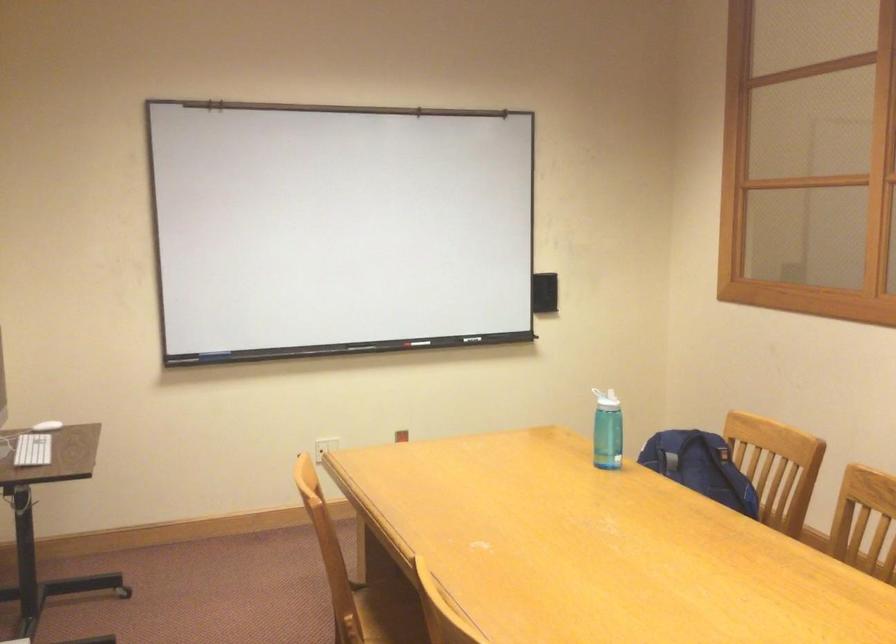
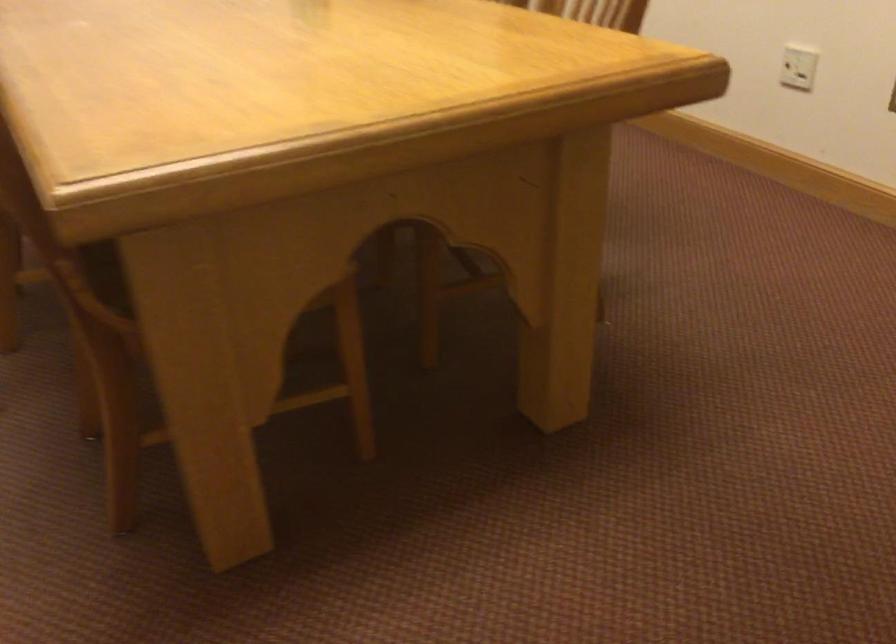
What movement of the cameraman would produce the second image?

The cameraman moved toward right, forward.